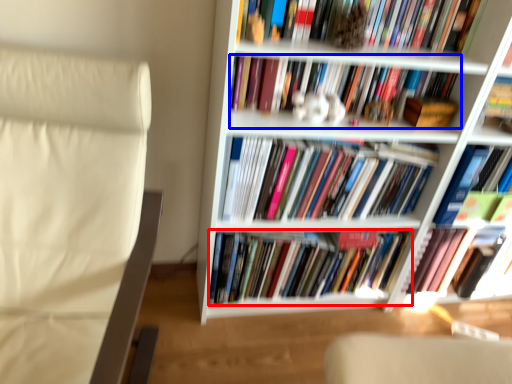
Question: Which object is further to the camera taking this photo, book (highlighted by a red box) or book (highlighted by a blue box)?

Choices:
 (A) book
 (B) book

Answer: (A)